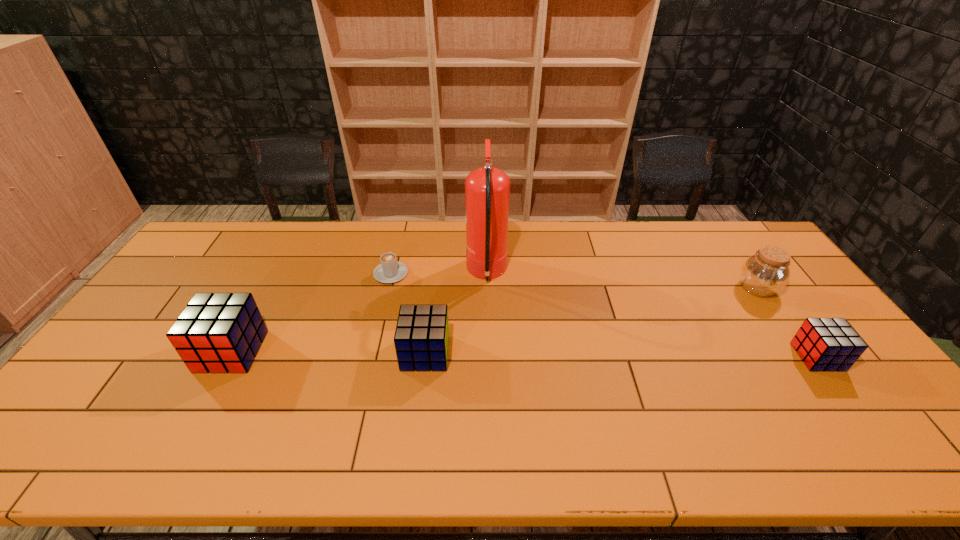
This screenshot has height=540, width=960. In order to click on free point located 0.230m on the left of the jar in this screenshot , I will do `click(663, 288)`.

The height and width of the screenshot is (540, 960). I want to click on object positioned at the far edge, so click(x=487, y=189).

I want to click on cube situated at the right edge, so click(x=824, y=344).

Where is `jar at the right edge`? The image size is (960, 540). jar at the right edge is located at coordinates coord(767,272).

Where is `vacant space at the far edge`? The height and width of the screenshot is (540, 960). vacant space at the far edge is located at coordinates (329, 247).

The width and height of the screenshot is (960, 540). In order to click on vacant space at the near edge of the desktop in this screenshot , I will do `click(559, 390)`.

Identify the location of vacant area at the right edge of the desktop. The width and height of the screenshot is (960, 540). (778, 316).

You are a GUI agent. You are given a task and a screenshot of the screen. Output one action in this format:
    pyautogui.click(x=<x>, y=<y>)
    Task: Click on the vacant area at the near left corner
    This screenshot has height=540, width=960.
    Given the screenshot: What is the action you would take?
    pyautogui.click(x=112, y=392)

Image resolution: width=960 pixels, height=540 pixels. Identify the location of unoccupied position between the jar and the second tallest cube. (591, 321).

What are the coordinates of `vacant space in between the cappuccino and the fourth object from left to right` in the screenshot? It's located at (439, 274).